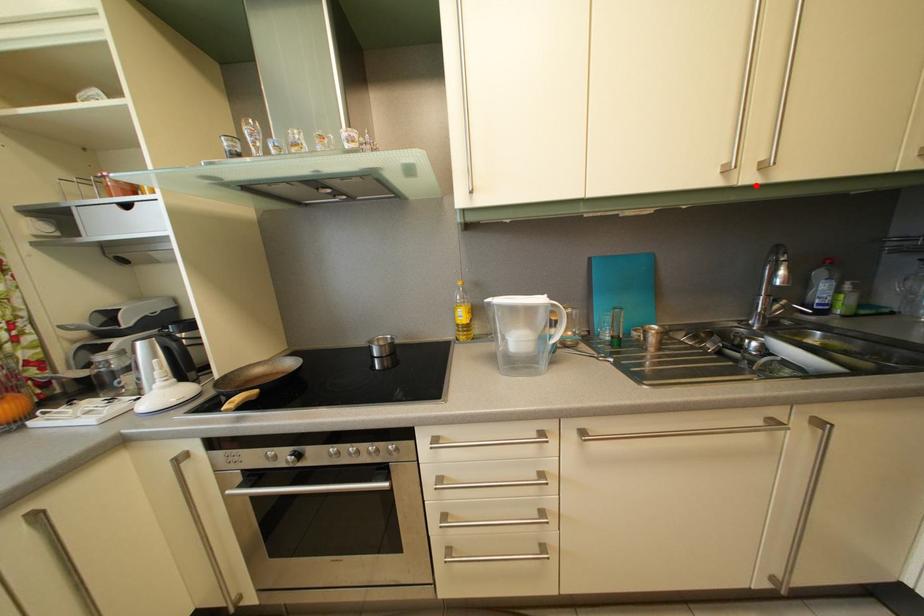
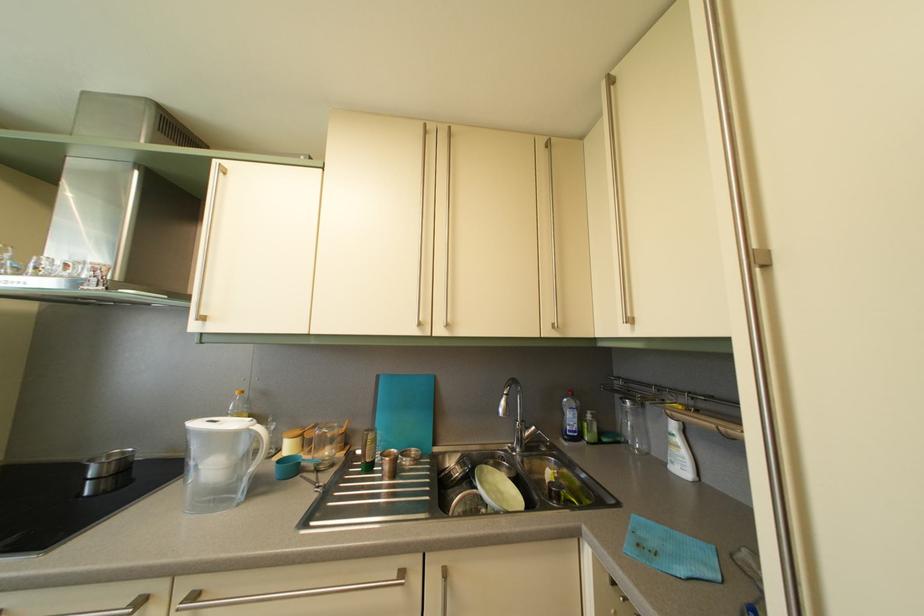
Locate, in the second image, the point that corresponds to the highlighted location in the first image.

(447, 339)